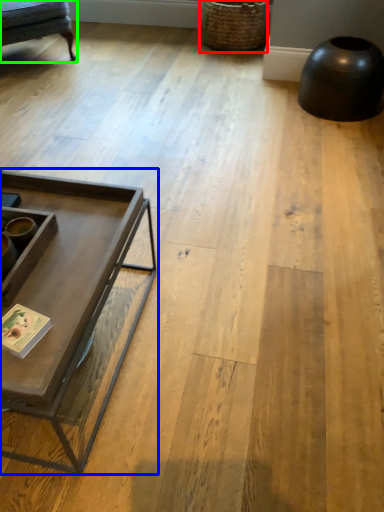
Question: Based on their relative distances, which object is farther from basket (highlighted by a red box)? Choose from coffee table (highlighted by a blue box) and swivel chair (highlighted by a green box).

Choices:
 (A) coffee table
 (B) swivel chair

Answer: (A)